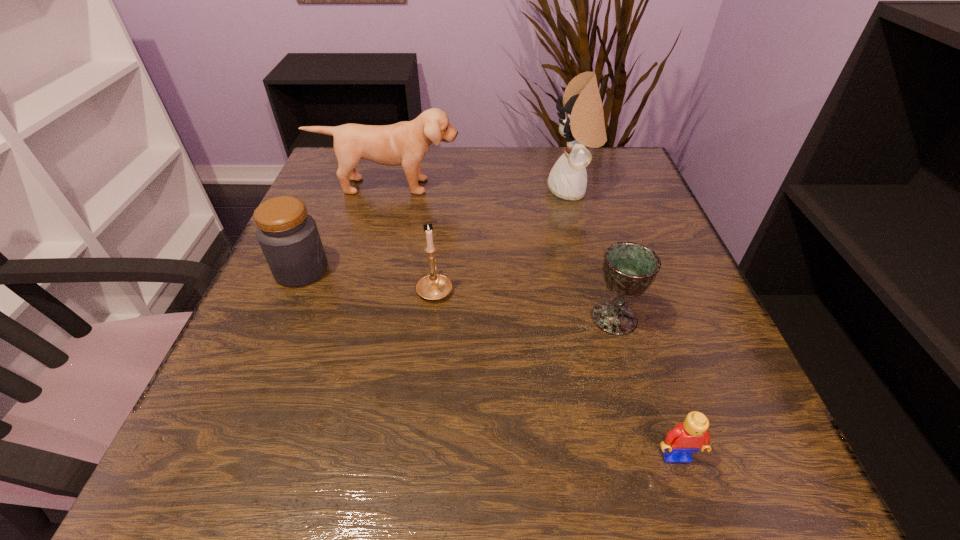
Locate an element on the screen. vacant space situated 0.390m on the left side of the puppy is located at coordinates (348, 329).

Where is `blank area located 0.200m on the handle side of the candle holder`? The height and width of the screenshot is (540, 960). blank area located 0.200m on the handle side of the candle holder is located at coordinates (443, 210).

The height and width of the screenshot is (540, 960). Find the location of `vacant space located on the handle side of the candle holder`. vacant space located on the handle side of the candle holder is located at coordinates (441, 233).

I want to click on vacant region located on the handle side of the candle holder, so click(447, 164).

Identify the location of vacant space located on the surface of the jar near the warning symbol. click(523, 270).

I want to click on free space located 0.100m on the right of the chalice, so click(698, 318).

Identify the location of doll that is positioned at the far edge. (583, 124).

Where is `puppy present at the far edge`? The image size is (960, 540). puppy present at the far edge is located at coordinates (405, 143).

The width and height of the screenshot is (960, 540). What are the coordinates of `object present at the near edge` in the screenshot? It's located at (687, 437).

Locate an element on the screen. Image resolution: width=960 pixels, height=540 pixels. puppy that is at the left edge is located at coordinates (405, 143).